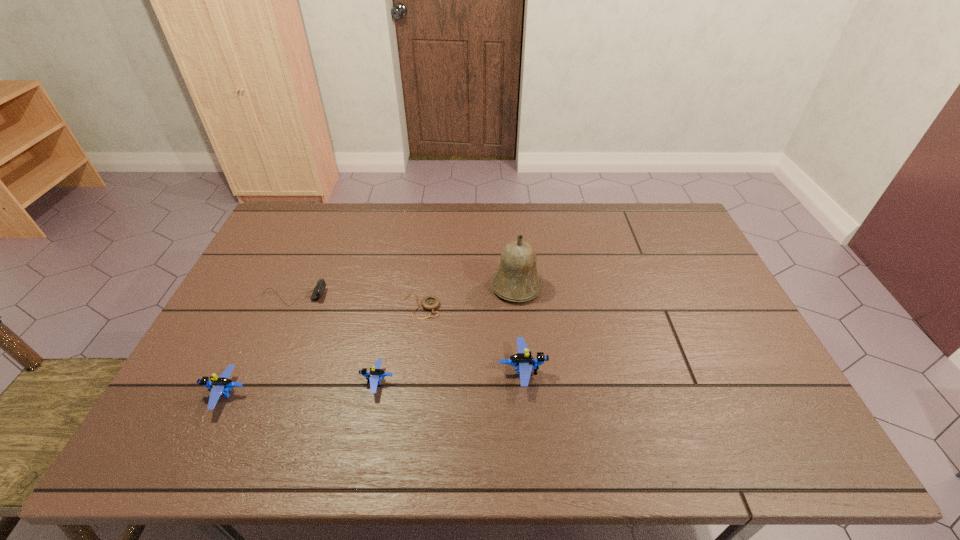
I want to click on free space at the far edge of the desktop, so click(x=582, y=235).

The image size is (960, 540). Find the location of `free space at the near edge`. free space at the near edge is located at coordinates (667, 394).

This screenshot has height=540, width=960. In order to click on vacant space at the left edge of the desktop in this screenshot , I will do `click(263, 305)`.

Locate an element on the screen. This screenshot has height=540, width=960. vacant space at the right edge of the desktop is located at coordinates (721, 340).

Where is `blank space at the far right corner of the desktop`? The width and height of the screenshot is (960, 540). blank space at the far right corner of the desktop is located at coordinates pos(654,238).

You are a GUI agent. You are given a task and a screenshot of the screen. Output one action in this format:
    pyautogui.click(x=<x>, y=<y>)
    Task: Click on the vacant space at the near right corner of the desktop
    
    Given the screenshot: What is the action you would take?
    pyautogui.click(x=713, y=384)

Locate an element on the screen. This screenshot has width=960, height=540. empty space between the shortest Lego and the bell is located at coordinates (447, 334).

This screenshot has height=540, width=960. What are the coordinates of `free space between the second Lego from right to left and the tallest Lego` in the screenshot? It's located at (450, 376).

In order to click on free space between the pocket watch and the rightmost Lego in this screenshot , I will do `click(471, 339)`.

At what (x,y) coordinates should I click in order to perform the action: click on vacant area that lies between the bell and the second shortest object. Please return your answer as a coordinate pair (x, y). This screenshot has height=540, width=960. Looking at the image, I should click on (405, 292).